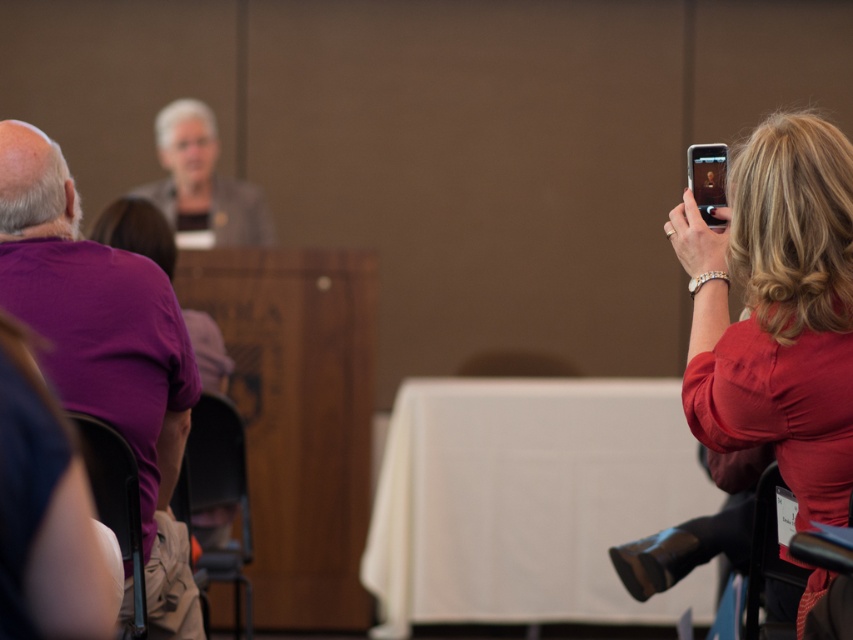
Who is positioned more to the right, matte red shirt at right or purple cotton shirt at left?

From the viewer's perspective, matte red shirt at right appears more on the right side.

Between matte red shirt at right and purple cotton shirt at left, which one is positioned lower?

Positioned lower is matte red shirt at right.

Identify the location of matte red shirt at right. The image size is (853, 640). (776, 308).

Does purple cotton shirt at left have a lesser width compared to matte gray blazer at center?

Yes.

Who is positioned more to the left, purple cotton shirt at left or matte gray blazer at center?

Positioned to the left is matte gray blazer at center.

The image size is (853, 640). In order to click on purple cotton shirt at left in this screenshot , I will do `click(103, 348)`.

At what (x,y) coordinates should I click in order to perform the action: click on purple cotton shirt at left. Please return your answer as a coordinate pair (x, y). Looking at the image, I should click on (103, 348).

Is matte red shirt at right positioned in front of matte gray blazer at center?

Yes, it is.

Is matte red shirt at right shorter than matte gray blazer at center?

No.

Which is in front, point (788, 193) or point (241, 198)?

Point (788, 193) is in front.

Where is `matte red shirt at right`? The image size is (853, 640). matte red shirt at right is located at coordinates (776, 308).